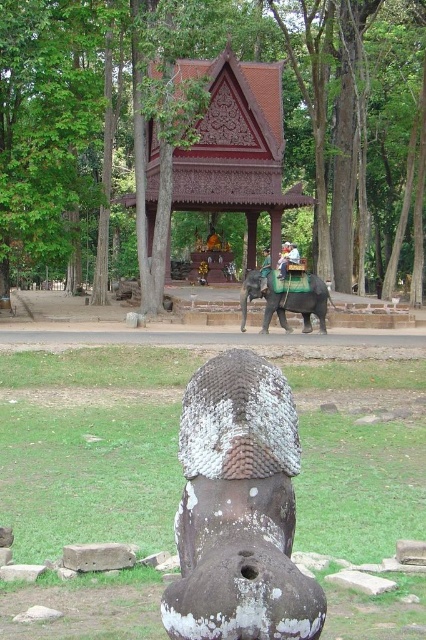
Which is in front, point (198, 179) or point (313, 310)?

Point (313, 310)

Is carved wood gazebo at center in front of gray textured elephant at center?

No, it is behind gray textured elephant at center.

Is point (222, 128) less distant than point (287, 324)?

No, (222, 128) is further to viewer.

This screenshot has width=426, height=640. I want to click on carved wood gazebo at center, so click(236, 147).

Looking at this image, can you confirm if brown wood tree at center is positioned below gray textured elephant at center?

Incorrect, brown wood tree at center is not positioned below gray textured elephant at center.

Does brown wood tree at center appear over gray textured elephant at center?

Indeed, brown wood tree at center is positioned over gray textured elephant at center.

Locate an element on the screen. The height and width of the screenshot is (640, 426). brown wood tree at center is located at coordinates (218, 128).

Locate an element on the screen. Image resolution: width=426 pixels, height=640 pixels. brown wood tree at center is located at coordinates (218, 128).

Can you confirm if gray textured elephant at center is thinner than white cloth-covered person at center?

Yes.

Between gray textured elephant at center and white cloth-covered person at center, which one has more height?

Standing taller between the two is white cloth-covered person at center.

Where is `gray textured elephant at center`? gray textured elephant at center is located at coordinates (285, 300).

I want to click on gray textured elephant at center, so click(x=285, y=300).